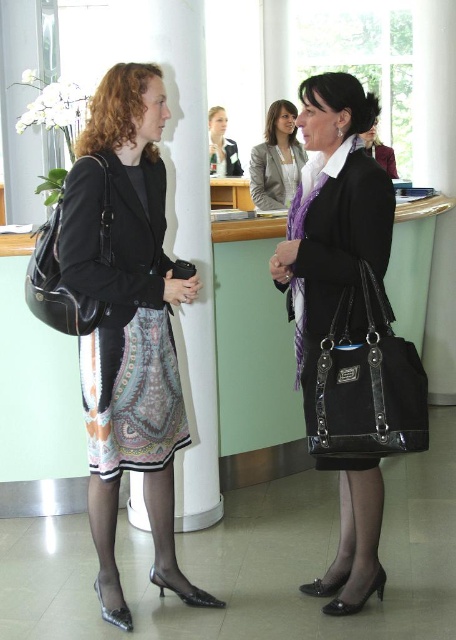
You are a photographer setting up for a portrait. You need to focus on the printed silk dress at left and the black leather handbag at left. Which object should you adjust your camera focus on first if you want to ensure the dress is in focus before the handbag?

The printed silk dress at left is closer to the viewer than the black leather handbag at left, so you should focus on the dress first. Since it is nearer, adjusting focus starting from the dress ensures that when you adjust for depth of field, the handbag will come into focus afterward if needed.

You are standing in the office scene and want to determine which of the two points, point (x=337, y=435) or point (x=273, y=205), is nearer to you. Based on the description, which point is closer?

Point (x=337, y=435) is closer to the viewer than point (x=273, y=205).

Looking at this image, you are standing in the office scene and want to know which of the two points, point (x=172, y=365) or point (x=156, y=280), is closer to you. Which one is closer?

Point (x=156, y=280) is closer to you because it is less further to the camera than point (x=172, y=365).